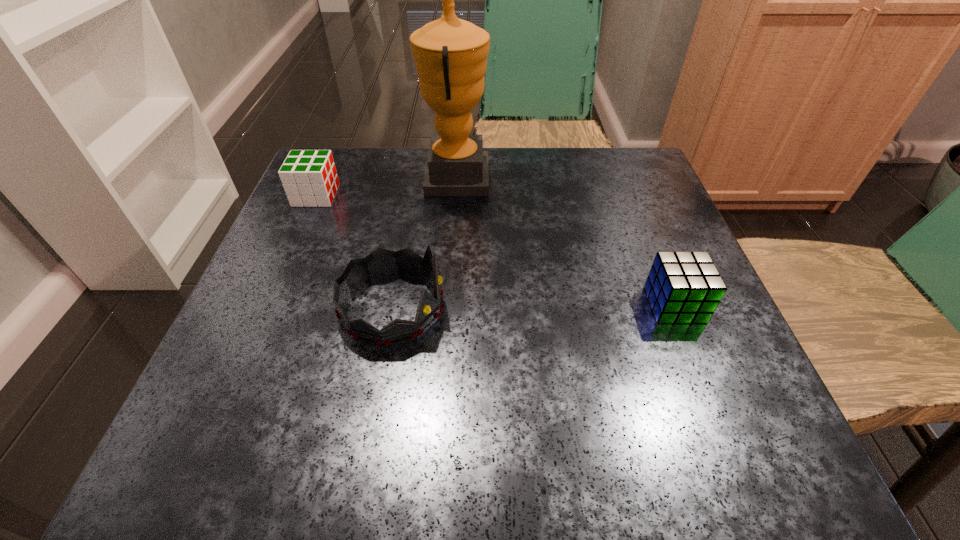
I want to click on free space between the farther cube and the nearer cube, so click(495, 249).

Locate an element on the screen. This screenshot has height=540, width=960. vacant region between the left cube and the nearer cube is located at coordinates (495, 249).

Find the location of `free space between the third shortest object and the left cube`. free space between the third shortest object and the left cube is located at coordinates (354, 252).

Find the location of a particular element. This screenshot has width=960, height=540. free space between the award and the nearer cube is located at coordinates (565, 241).

Identify which object is the second closest to the left cube. Please provide its 2D coordinates. Your answer should be formatted as a tuple, i.e. [(x, y)], where the tuple contains the x and y coordinates of a point satisfying the conditions above.

[(381, 262)]

Identify which object is located as the nearest to the rightmost object. Please provide its 2D coordinates. Your answer should be formatted as a tuple, i.e. [(x, y)], where the tuple contains the x and y coordinates of a point satisfying the conditions above.

[(381, 262)]

The image size is (960, 540). Find the location of `vacant space that satisfies the following two spatial constraints: 1. at the front of the award with handles; 2. on the right side of the right cube`. vacant space that satisfies the following two spatial constraints: 1. at the front of the award with handles; 2. on the right side of the right cube is located at coordinates (447, 304).

I want to click on free space in the image that satisfies the following two spatial constraints: 1. on the front side of the rightmost object; 2. at the front of the tiara with jewels, so click(676, 308).

Locate an element on the screen. This screenshot has height=540, width=960. free space that satisfies the following two spatial constraints: 1. on the red face of the farther cube; 2. on the right side of the nearer cube is located at coordinates (269, 304).

Where is `vacant region that satisfies the following two spatial constraints: 1. on the back side of the right cube; 2. at the front of the award with handles`? vacant region that satisfies the following two spatial constraints: 1. on the back side of the right cube; 2. at the front of the award with handles is located at coordinates (624, 178).